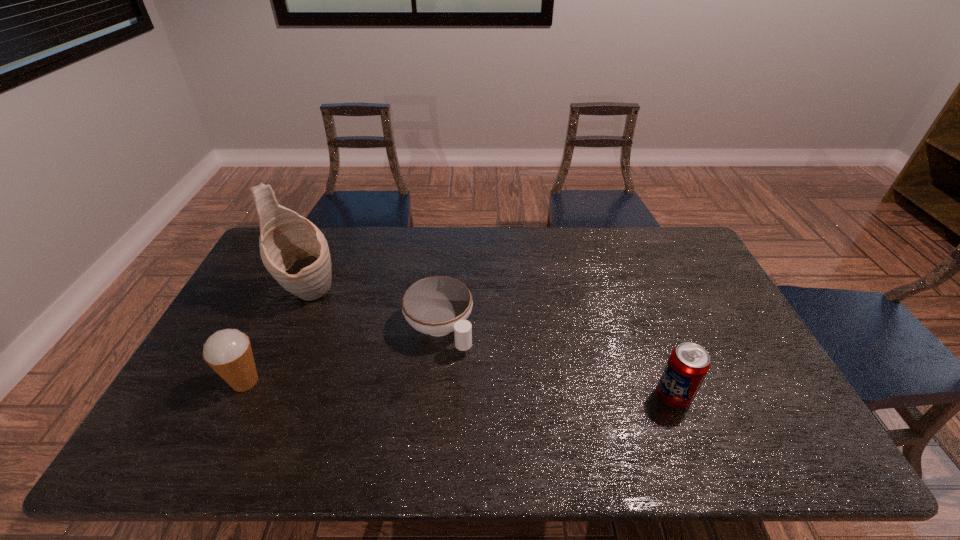
At what (x,y) coordinates should I click in order to perform the action: click on free space on the desktop that is between the icecream and the soda can and is positioned on the side with the handle of the second object from right to left. Please return your answer as a coordinate pair (x, y). This screenshot has width=960, height=540. Looking at the image, I should click on (492, 390).

The height and width of the screenshot is (540, 960). Identify the location of free space on the desktop that is between the icecream and the soda can and is positioned at the spout of the pitcher. (420, 388).